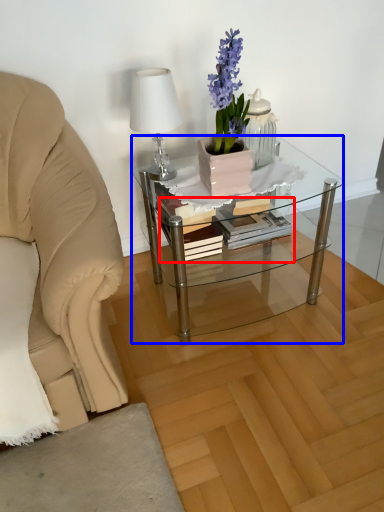
Question: Which object appears closest to the camera in this image, book (highlighted by a red box) or coffee table (highlighted by a blue box)?

Choices:
 (A) book
 (B) coffee table

Answer: (B)